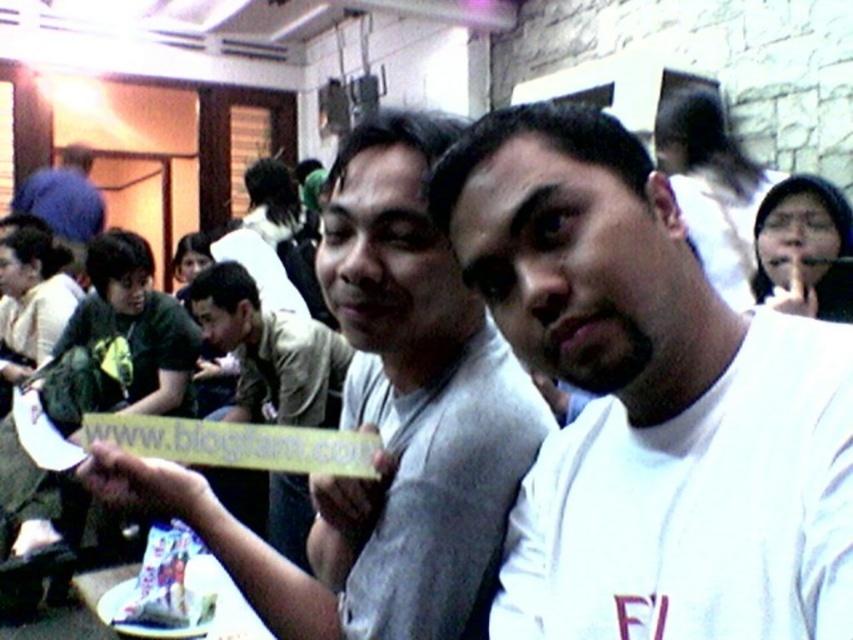
Between gray fabric shirt at center and smooth skin face at upper right, which one appears on the right side from the viewer's perspective?

smooth skin face at upper right is more to the right.

Is gray fabric shirt at center positioned at the back of smooth skin face at upper right?

No.

Describe the element at coordinates (384, 422) in the screenshot. This screenshot has height=640, width=853. I see `gray fabric shirt at center` at that location.

Where is `gray fabric shirt at center`? gray fabric shirt at center is located at coordinates (384, 422).

Is white matte shirt at center positioned in front of white paper plate at lower center?

That is True.

Does white matte shirt at center have a greater height compared to white paper plate at lower center?

Indeed, white matte shirt at center has a greater height compared to white paper plate at lower center.

Between point (689, 630) and point (171, 632), which one is positioned behind?

The point (171, 632) is more distant.

Find the location of a particular element. white matte shirt at center is located at coordinates pyautogui.click(x=648, y=403).

Between white matte shirt at center and gray fabric shirt at center, which one has less height?

white matte shirt at center is shorter.

Which of these two, white matte shirt at center or gray fabric shirt at center, stands taller?

gray fabric shirt at center

Find the location of a particular element. Image resolution: width=853 pixels, height=640 pixels. white matte shirt at center is located at coordinates (648, 403).